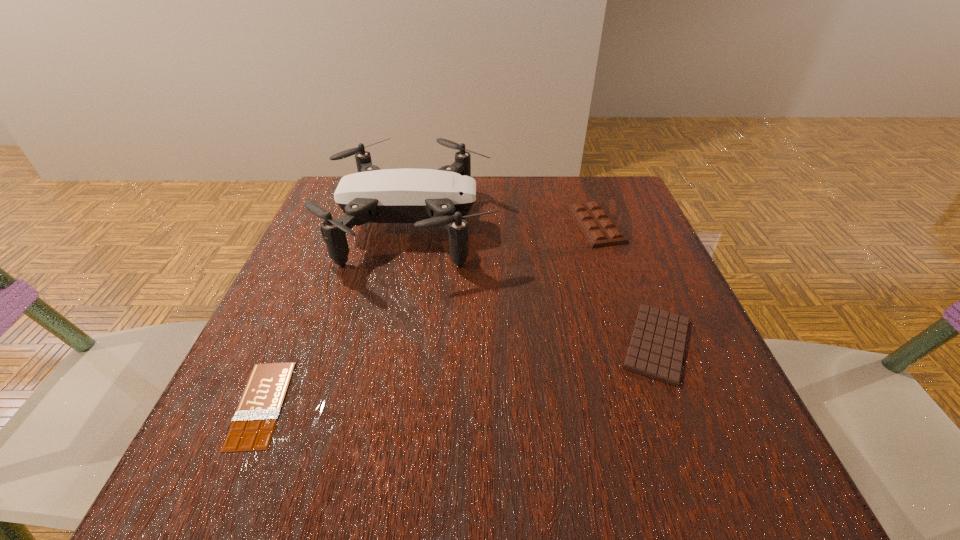
In the image, there is a desktop. Identify the location of vacant region at the left edge. The width and height of the screenshot is (960, 540). (238, 394).

I want to click on free space at the right edge of the desktop, so click(625, 317).

In the image, there is a desktop. At what (x,y) coordinates should I click in order to perform the action: click on free space at the far left corner. Please return your answer as a coordinate pair (x, y). This screenshot has height=540, width=960. Looking at the image, I should click on (332, 190).

You are a GUI agent. You are given a task and a screenshot of the screen. Output one action in this format:
    pyautogui.click(x=<x>, y=<y>)
    Task: Click on the free location at the near left corner of the desktop
    
    Given the screenshot: What is the action you would take?
    pyautogui.click(x=294, y=455)

In the image, there is a desktop. Identify the location of vacant space at the far right corner. The image size is (960, 540). (630, 225).

Identify the location of free region at the near right corner of the desktop. (714, 464).

Identify the location of vacant region between the tallest object and the shortest chocolate bar. (337, 315).

The width and height of the screenshot is (960, 540). I want to click on vacant area that lies between the farthest chocolate bar and the second shortest object, so click(626, 284).

This screenshot has height=540, width=960. Find the location of `free spot between the drone and the leftmost chocolate bar`. free spot between the drone and the leftmost chocolate bar is located at coordinates (337, 315).

Identify the location of vacant space that is in between the shortest object and the second tallest chocolate bar. The height and width of the screenshot is (540, 960). [x=459, y=374].